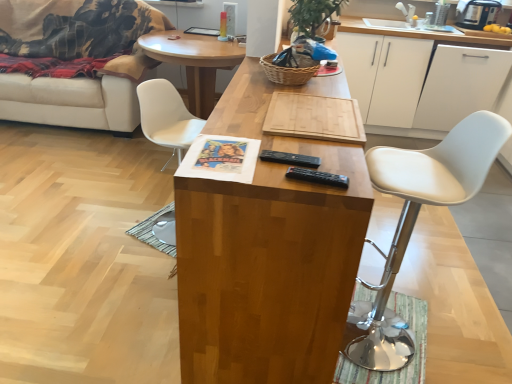
Locate an element on the screen. This screenshot has height=384, width=512. empty space that is ontop of natural wood cutting board at center (from a real-world perspective) is located at coordinates (317, 109).